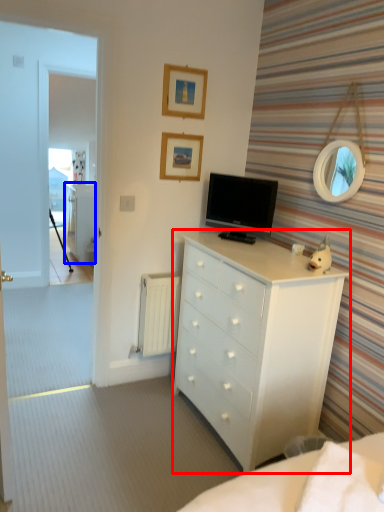
Question: Which object is further to the camera taking this photo, chest of drawers (highlighted by a red box) or file cabinet (highlighted by a blue box)?

Choices:
 (A) chest of drawers
 (B) file cabinet

Answer: (B)